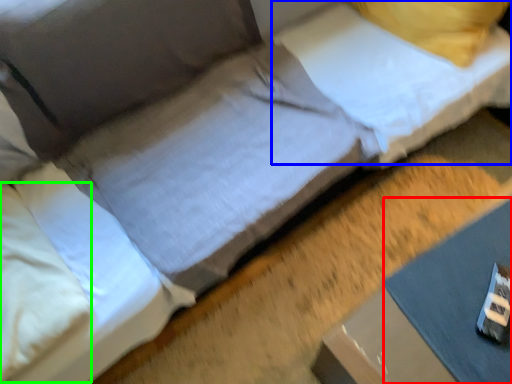
Question: Which object is the farthest from sheet (highlighted by a red box)? Choose among these: pillow (highlighted by a blue box) or pillow (highlighted by a green box).

Choices:
 (A) pillow
 (B) pillow

Answer: (B)